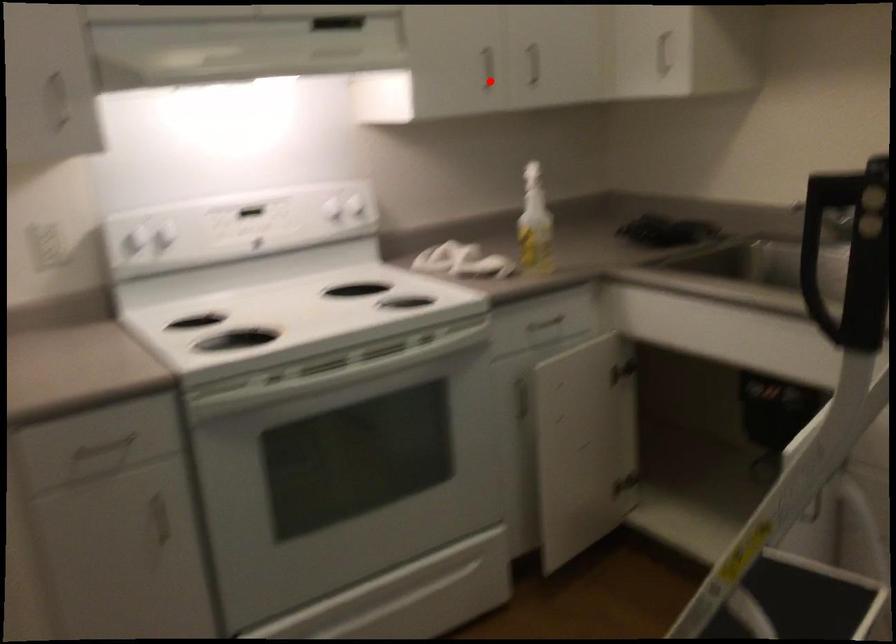
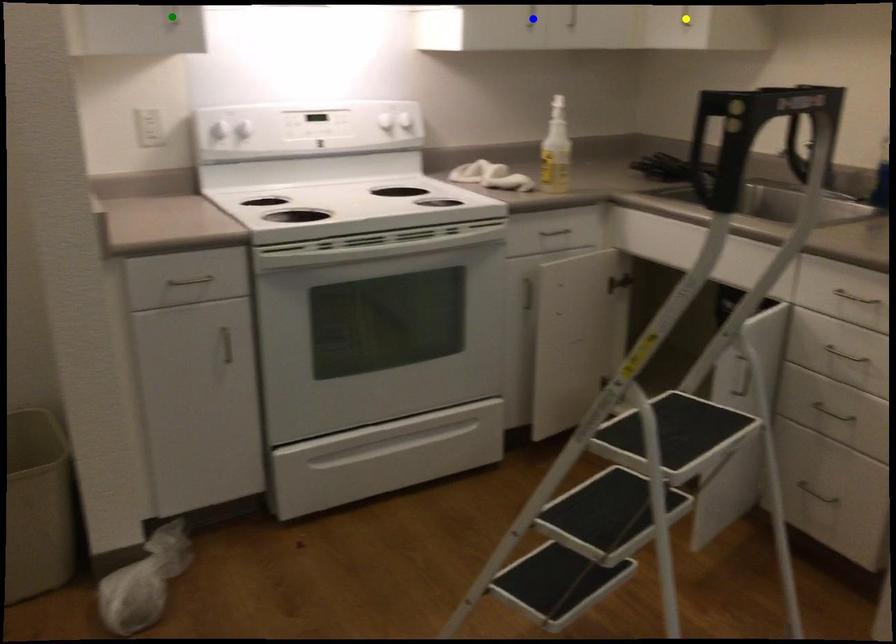
Question: I am providing you with two images of the same scene from different viewpoints. A red point is marked on the first image. You are given multiple points on the second image. Which point in image 2 represents the same 3d spot as the red point in image 1?

Choices:
 (A) blue point
 (B) green point
 (C) yellow point

Answer: (A)